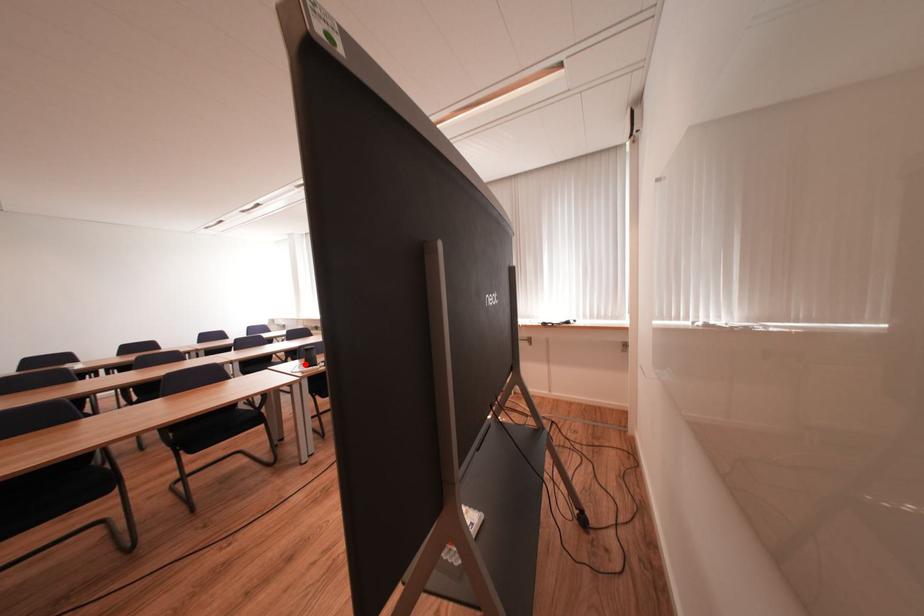
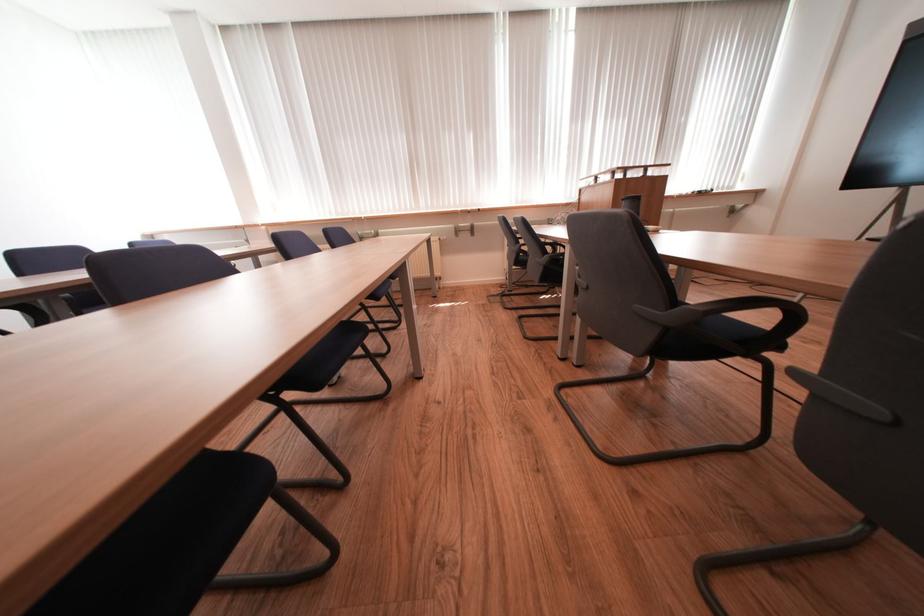
Question: I am providing you with two images of the same scene from different viewpoints. A red point is marked on the first image. Is the red point's position out of view in image 2?

Choices:
 (A) Yes
 (B) No

Answer: (A)